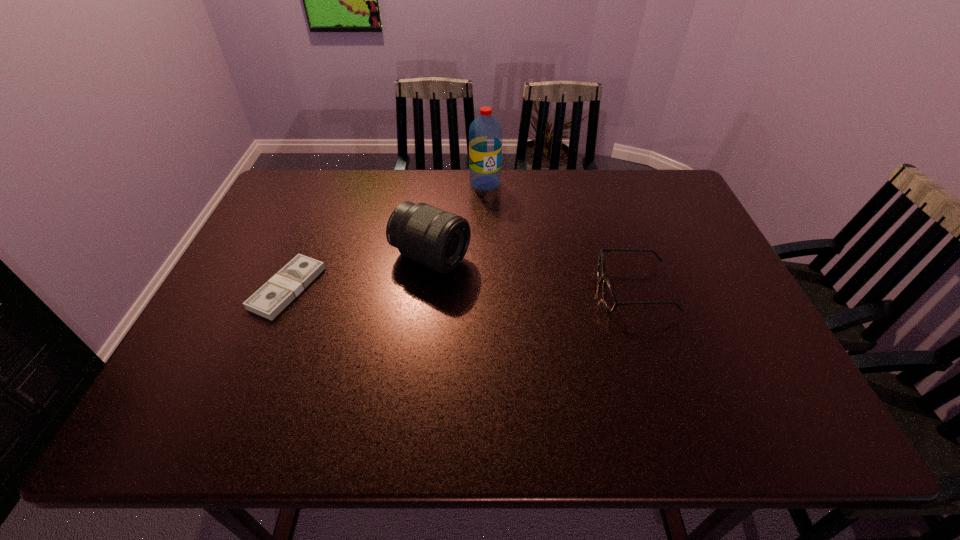
You are a GUI agent. You are given a task and a screenshot of the screen. Output one action in this format:
    pyautogui.click(x=<x>, y=<y>)
    Task: Click on the vacant position located 0.250m on the front-facing side of the rightmost object
    
    Given the screenshot: What is the action you would take?
    pyautogui.click(x=498, y=291)

Identify the location of vacant space situated on the front label of the tallest object. (493, 221).

Identify the location of free spot located on the front label of the tallest object. (506, 278).

You are a GUI agent. You are given a task and a screenshot of the screen. Output one action in this format:
    pyautogui.click(x=<x>, y=<y>)
    Task: Click on the vacant space located 0.170m on the front label of the tallest object
    The width and height of the screenshot is (960, 540).
    Given the screenshot: What is the action you would take?
    pyautogui.click(x=494, y=225)

I want to click on vacant space located 0.310m on the surface of the telephoto lens, so click(575, 321).

Where is `free space located on the surface of the telephoto lens`? Image resolution: width=960 pixels, height=540 pixels. free space located on the surface of the telephoto lens is located at coordinates (580, 322).

Where is `free space located on the surface of the telephoto lens`? free space located on the surface of the telephoto lens is located at coordinates (491, 284).

The width and height of the screenshot is (960, 540). In order to click on object that is at the far edge in this screenshot , I will do `click(485, 133)`.

Locate an element on the screen. This screenshot has width=960, height=540. object at the left edge is located at coordinates (278, 292).

I want to click on vacant space at the far edge of the desktop, so coord(496,194).